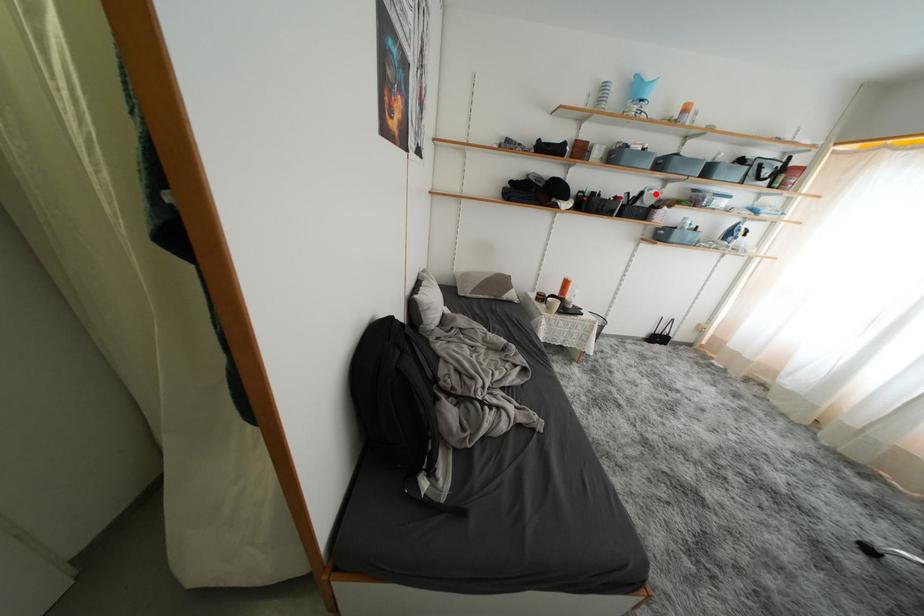
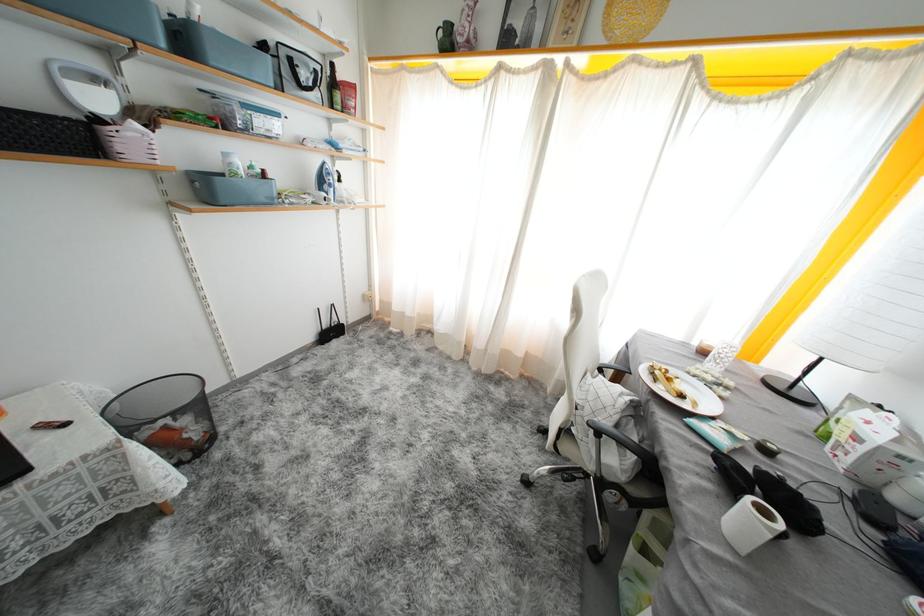
Question: I am providing you with two images of the same scene from different viewpoints. Image1 has a red point marked. In image2, the corresponding 3D location appears at what relative position? Reply with the corresponding letter.

Choices:
 (A) Closer
 (B) Farther

Answer: (B)